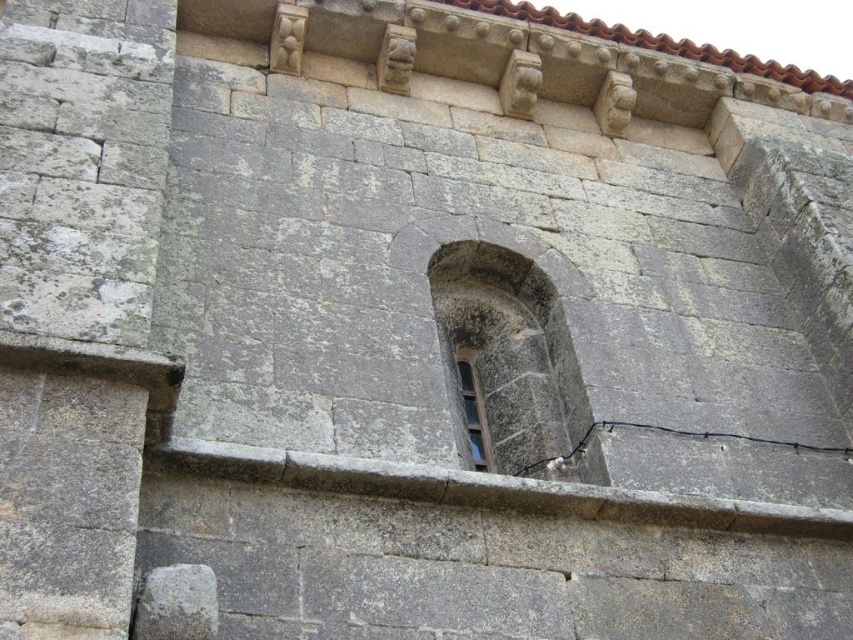
Does black rubber wire at lower center have a greater width compared to clear glass window at upper center?

Yes, black rubber wire at lower center is wider than clear glass window at upper center.

Is black rubber wire at lower center shorter than clear glass window at upper center?

Correct, black rubber wire at lower center is not as tall as clear glass window at upper center.

Is point (840, 451) positioned after point (463, 360)?

No, (840, 451) is closer to viewer.

Identify the location of black rubber wire at lower center. This screenshot has width=853, height=640. point(666,433).